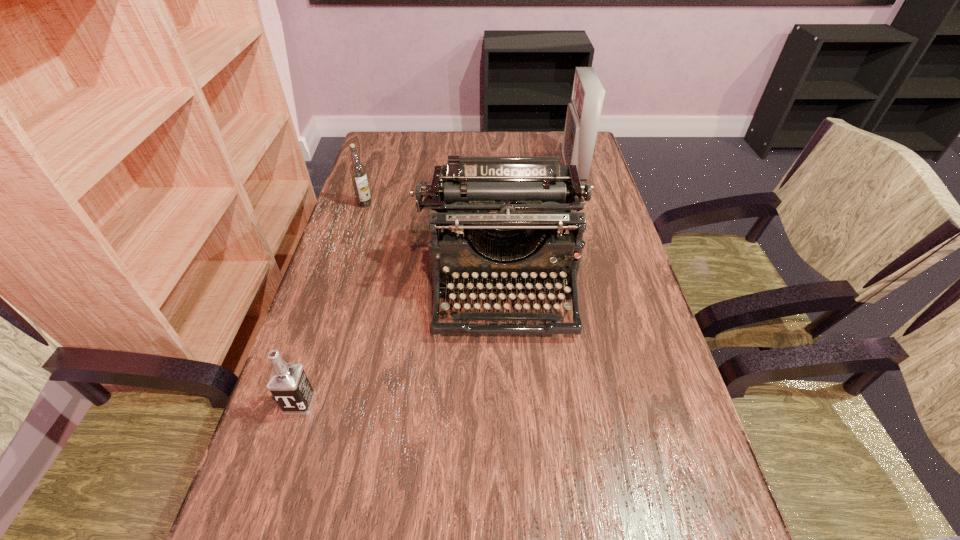
The height and width of the screenshot is (540, 960). I want to click on the first-aid kit, so click(x=583, y=113).

Identify the location of the farthest object. (583, 113).

Identify the location of typewriter. The image size is (960, 540). (513, 208).

Image resolution: width=960 pixels, height=540 pixels. Identify the location of the third farthest object. (513, 208).

Where is `the taller vodka`? This screenshot has width=960, height=540. the taller vodka is located at coordinates (358, 174).

Where is `the farther vodka`? the farther vodka is located at coordinates (358, 174).

This screenshot has width=960, height=540. What are the coordinates of `the nearest object` in the screenshot? It's located at (288, 383).

You are a GUI agent. You are given a task and a screenshot of the screen. Output one action in this format:
    pyautogui.click(x=<x>, y=<y>)
    Task: Click on the shortest object
    
    Given the screenshot: What is the action you would take?
    pyautogui.click(x=288, y=383)

At what (x,y) coordinates should I click in order to perform the action: click on vacant space located 0.330m on the front-facing side of the rightmost object. Please return your answer as a coordinate pair (x, y). Looking at the image, I should click on (464, 167).

Identify the location of vacant space situated on the front-facing side of the rightmost object. Image resolution: width=960 pixels, height=540 pixels. (531, 167).